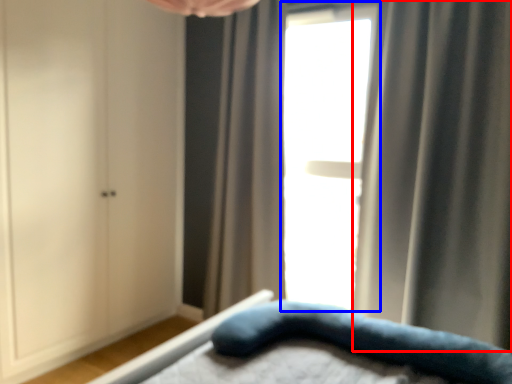
Question: Among these objects, which one is farthest to the camera, curtain (highlighted by a red box) or window (highlighted by a blue box)?

Choices:
 (A) curtain
 (B) window

Answer: (B)